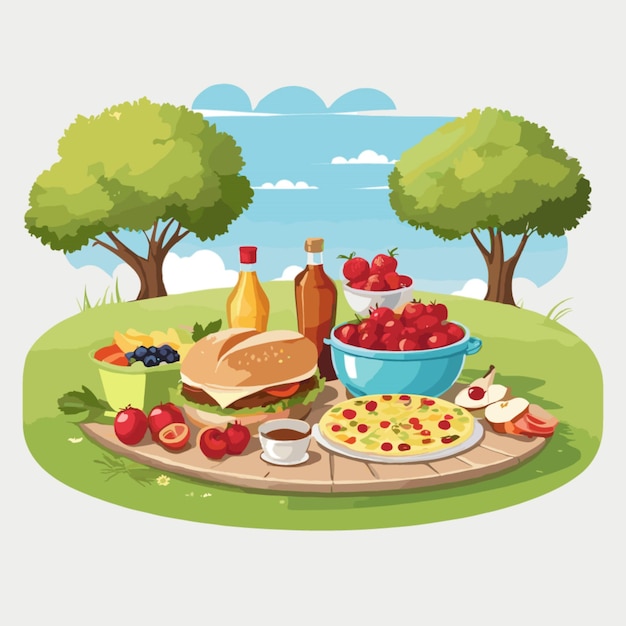
In order to click on cup in this screenshot , I will do `click(292, 444)`.